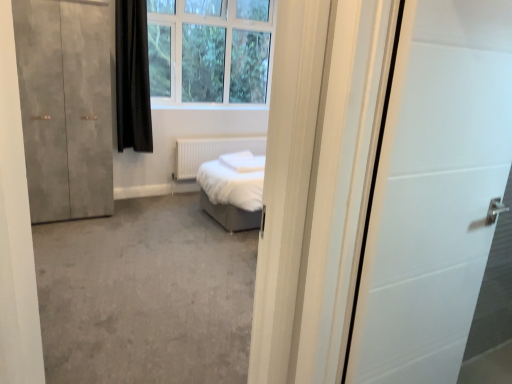
This screenshot has width=512, height=384. In order to click on blank space situated above white matte radiator at center (from a real-world perspective) in this screenshot , I will do `click(229, 134)`.